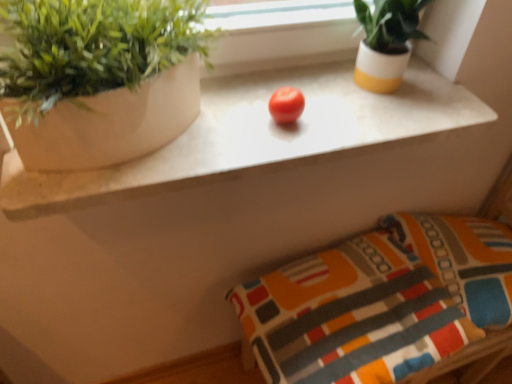
Question: Is red matte tomato at center further to the viewer compared to textured fabric pillow at lower right, acting as the 2th pillow starting from the right?

Choices:
 (A) yes
 (B) no

Answer: (B)

Question: Is red matte tomato at center oriented towards textured fabric pillow at lower right, the first pillow when ordered from left to right?

Choices:
 (A) yes
 (B) no

Answer: (B)

Question: Does red matte tomato at center lie in front of textured fabric pillow at lower right, acting as the 2th pillow starting from the right?

Choices:
 (A) yes
 (B) no

Answer: (A)

Question: Is red matte tomato at center smaller than textured fabric pillow at lower right, acting as the 2th pillow starting from the right?

Choices:
 (A) no
 (B) yes

Answer: (B)

Question: Considering the relative sizes of red matte tomato at center and textured fabric pillow at lower right, the first pillow when ordered from left to right, in the image provided, is red matte tomato at center thinner than textured fabric pillow at lower right, the first pillow when ordered from left to right,?

Choices:
 (A) no
 (B) yes

Answer: (B)

Question: Is white glossy pot at upper right inside or outside of textured fabric pillow at lower right, acting as the 2th pillow starting from the right?

Choices:
 (A) inside
 (B) outside

Answer: (B)

Question: Looking at the image, does white glossy pot at upper right seem bigger or smaller compared to textured fabric pillow at lower right, acting as the 2th pillow starting from the right?

Choices:
 (A) small
 (B) big

Answer: (A)

Question: In terms of width, does white glossy pot at upper right look wider or thinner when compared to textured fabric pillow at lower right, the first pillow when ordered from left to right?

Choices:
 (A) thin
 (B) wide

Answer: (A)

Question: Based on their positions, is white glossy pot at upper right located to the left or right of textured fabric pillow at lower right, acting as the 2th pillow starting from the right?

Choices:
 (A) right
 (B) left

Answer: (A)

Question: Choose the correct answer: Is white marble counter at center inside red matte tomato at center or outside it?

Choices:
 (A) inside
 (B) outside

Answer: (B)

Question: Considering the positions of white marble counter at center and red matte tomato at center in the image, is white marble counter at center bigger or smaller than red matte tomato at center?

Choices:
 (A) big
 (B) small

Answer: (A)

Question: Relative to red matte tomato at center, is white marble counter at center in front or behind?

Choices:
 (A) behind
 (B) front

Answer: (B)

Question: In terms of height, does white marble counter at center look taller or shorter compared to red matte tomato at center?

Choices:
 (A) short
 (B) tall

Answer: (A)

Question: Considering the positions of point (378, 139) and point (425, 246), is point (378, 139) closer or farther from the camera than point (425, 246)?

Choices:
 (A) farther
 (B) closer

Answer: (B)

Question: From a real-world perspective, is white marble counter at center physically located above or below textured fabric pillow at lower right, the first pillow when ordered from left to right?

Choices:
 (A) above
 (B) below

Answer: (A)